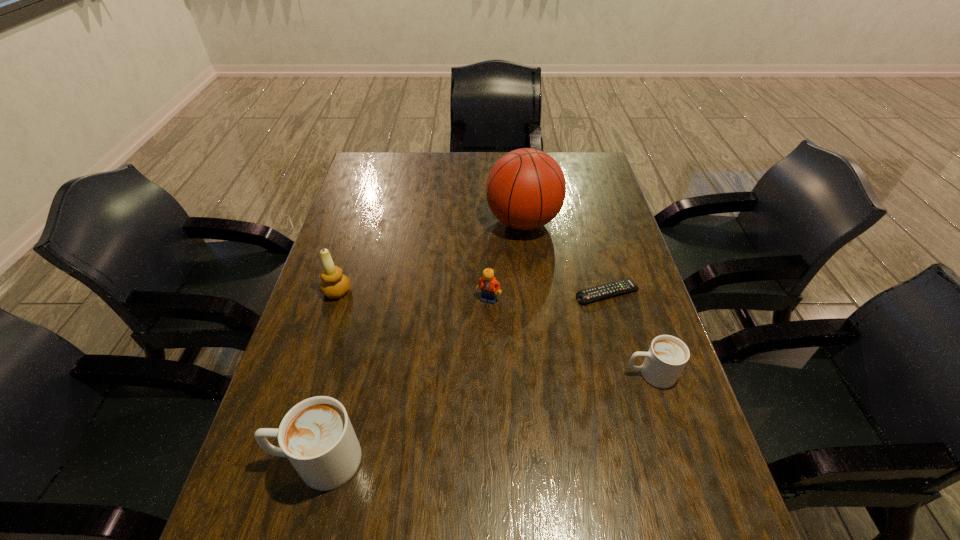
Where is `the left cappuccino`? the left cappuccino is located at coordinates (316, 435).

Where is `the taller cappuccino`? The width and height of the screenshot is (960, 540). the taller cappuccino is located at coordinates (316, 435).

The width and height of the screenshot is (960, 540). Identify the location of the right cappuccino. (667, 356).

In order to click on the farther cappuccino in this screenshot , I will do `click(667, 356)`.

Locate an element on the screen. The width and height of the screenshot is (960, 540). the farthest object is located at coordinates (526, 188).

This screenshot has height=540, width=960. Find the location of `basketball`. basketball is located at coordinates (526, 188).

Find the location of a particular element. Image resolution: width=960 pixels, height=540 pixels. candle_holder is located at coordinates (334, 284).

The width and height of the screenshot is (960, 540). Find the location of `the third shortest object`. the third shortest object is located at coordinates (488, 284).

This screenshot has height=540, width=960. Find the location of `remote control`. remote control is located at coordinates (611, 289).

I want to click on free space located on the side with the handle of the fifth farthest object, so click(590, 374).